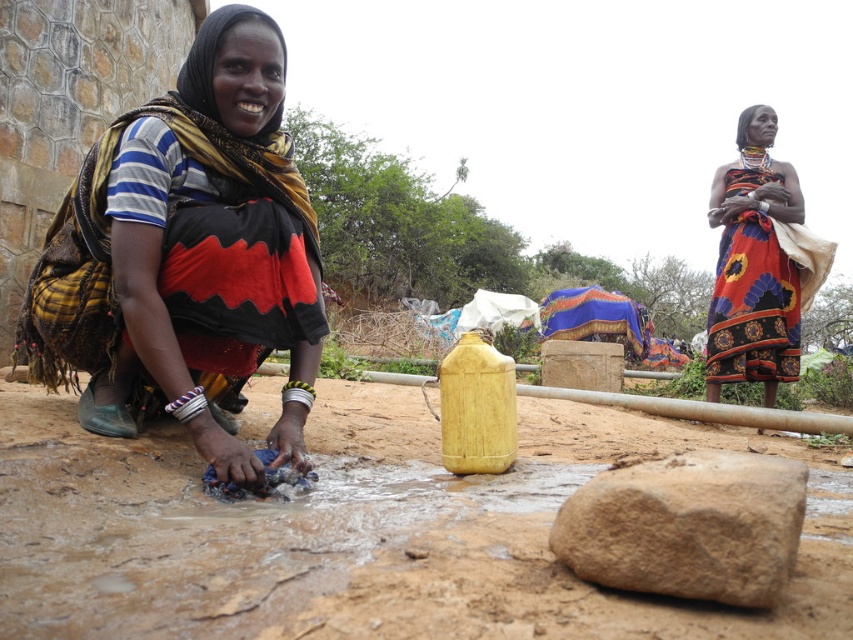
From the picture: Does dull brown dirt at center have a greater height compared to brown rough rock at lower center?

Indeed, dull brown dirt at center has a greater height compared to brown rough rock at lower center.

Can you confirm if dull brown dirt at center is positioned above brown rough rock at lower center?

No, dull brown dirt at center is not above brown rough rock at lower center.

Identify the location of dull brown dirt at center. (361, 532).

Does matte black fabric at lower left appear on the left side of brown rough rock at lower center?

Correct, you'll find matte black fabric at lower left to the left of brown rough rock at lower center.

Is matte black fabric at lower left to the right of brown rough rock at lower center from the viewer's perspective?

In fact, matte black fabric at lower left is to the left of brown rough rock at lower center.

Is point (80, 193) in front of point (643, 461)?

No, (80, 193) is behind (643, 461).

You are a GUI agent. You are given a task and a screenshot of the screen. Output one action in this format:
    pyautogui.click(x=<x>, y=<y>)
    Task: Click on the matte black fabric at lower left
    This screenshot has width=853, height=640.
    Given the screenshot: What is the action you would take?
    pyautogui.click(x=187, y=256)

Is dull brown dirt at center behind matte black fabric at lower left?

No, it is in front of matte black fabric at lower left.

Where is `dull brown dirt at center`? This screenshot has width=853, height=640. dull brown dirt at center is located at coordinates (361, 532).